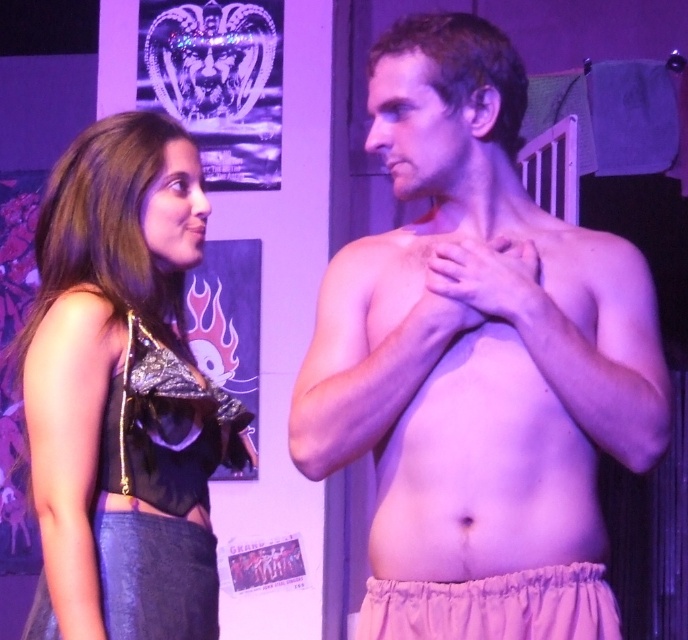
Which is more to the right, pink fabric shorts at center or elastic white underwear at lower center?

elastic white underwear at lower center is more to the right.

Between point (455, 342) and point (488, 621), which one is positioned in front?

Point (488, 621) is more forward.

What do you see at coordinates (477, 360) in the screenshot?
I see `pink fabric shorts at center` at bounding box center [477, 360].

You are a GUI agent. You are given a task and a screenshot of the screen. Output one action in this format:
    pyautogui.click(x=<x>, y=<y>)
    Task: Click on the pink fabric shorts at center
    This screenshot has height=640, width=688.
    Given the screenshot: What is the action you would take?
    pyautogui.click(x=477, y=360)

Between point (30, 348) and point (455, 394), which one is positioned in front?

Point (455, 394)

Does point (173, 371) come farther from viewer compared to point (557, 561)?

That is True.

Where is `shiny black top at left`? This screenshot has height=640, width=688. shiny black top at left is located at coordinates (122, 392).

Which of these two, pink fabric shorts at center or shiny black top at left, stands shorter?

shiny black top at left

Does point (484, 634) lie in front of point (136, 205)?

Yes, it is.

Find the location of a particular element. pink fabric shorts at center is located at coordinates (477, 360).